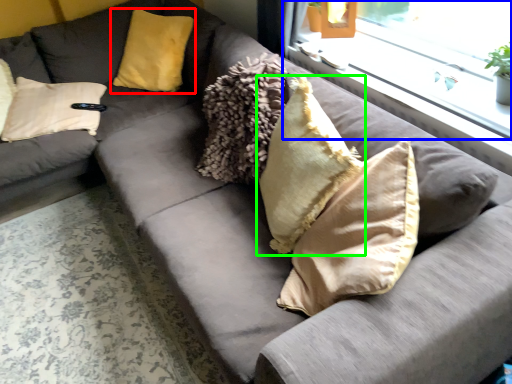
Question: Considering the real-world distances, which object is closest to pillow (highlighted by a red box)? window (highlighted by a blue box) or pillow (highlighted by a green box).

Choices:
 (A) window
 (B) pillow

Answer: (A)